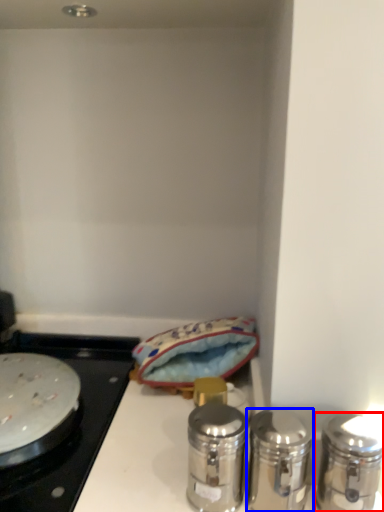
Question: Which point is further to the camera, salt and pepper shakers (highlighted by a red box) or salt and pepper shakers (highlighted by a blue box)?

Choices:
 (A) salt and pepper shakers
 (B) salt and pepper shakers

Answer: (B)